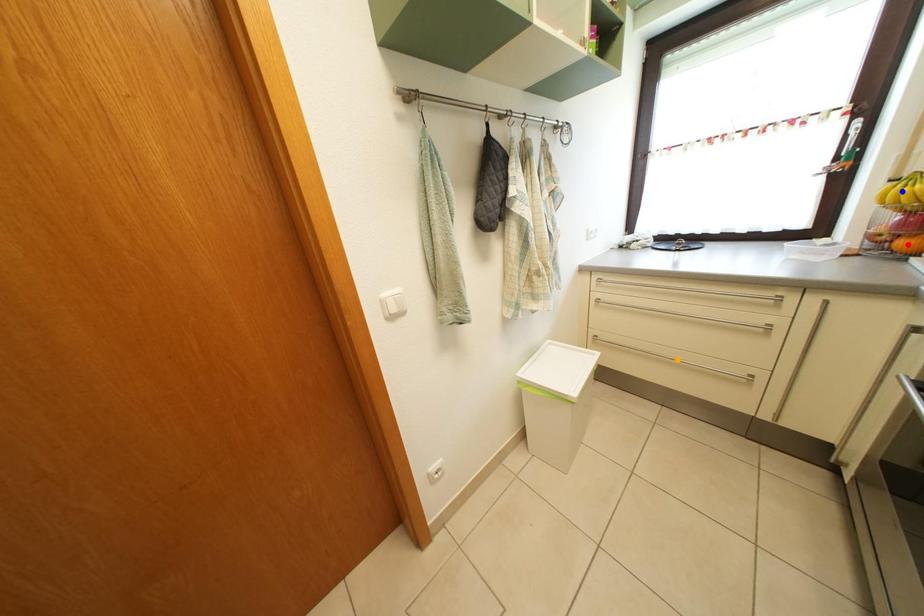
Order these from nearest to farthest:
- orange point
- red point
- blue point

1. orange point
2. blue point
3. red point